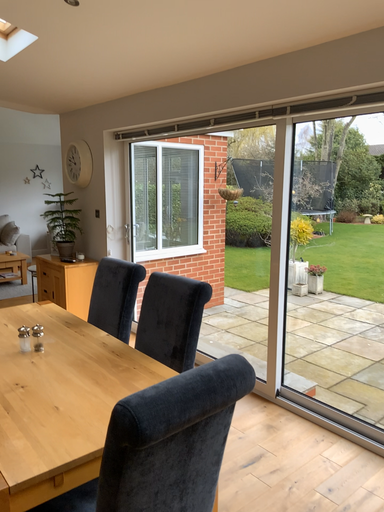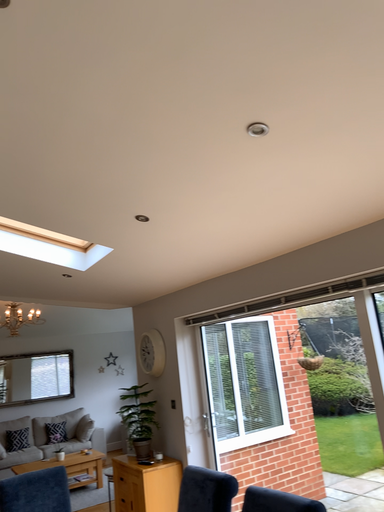
Question: How did the camera likely rotate when shooting the video?

Choices:
 (A) rotated downward
 (B) rotated upward

Answer: (B)